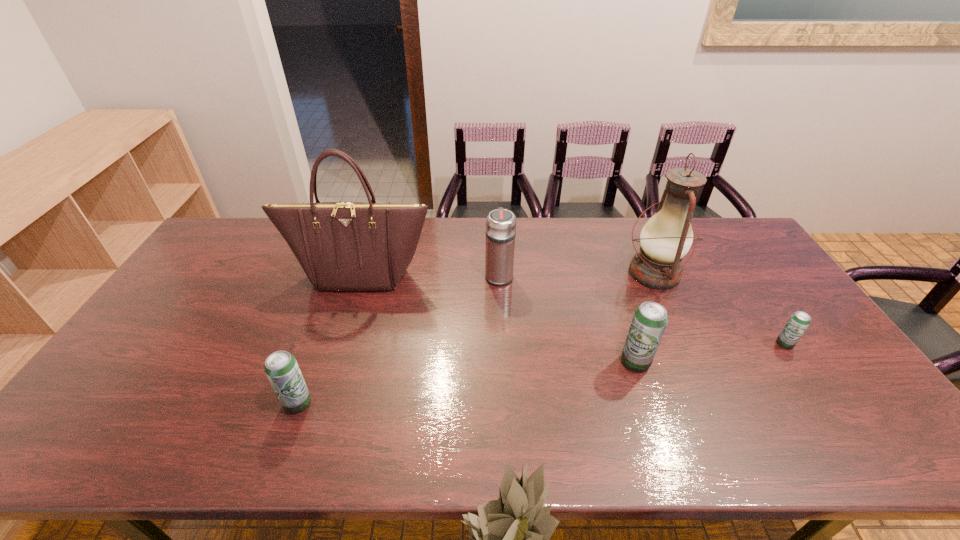
Locate an element on the screen. the second shortest beer can is located at coordinates point(281,367).

I want to click on the nearest object, so click(281, 367).

The height and width of the screenshot is (540, 960). What are the coordinates of `the second beer can from right to left` in the screenshot? It's located at (650, 319).

At what (x,y) coordinates should I click in order to perform the action: click on the second nearest object. Please return your answer as a coordinate pair (x, y). This screenshot has height=540, width=960. Looking at the image, I should click on (650, 319).

Image resolution: width=960 pixels, height=540 pixels. In order to click on the shortest object in this screenshot , I will do click(x=799, y=321).

The image size is (960, 540). I want to click on the rightmost beer can, so click(799, 321).

At what (x,y) coordinates should I click in order to perform the action: click on handbag. Please return your answer as a coordinate pair (x, y). The height and width of the screenshot is (540, 960). Looking at the image, I should click on (342, 246).

Image resolution: width=960 pixels, height=540 pixels. I want to click on oil lamp, so click(x=667, y=236).

I want to click on the third object from left to right, so click(x=500, y=232).

Find the location of `thermos bottle`. thermos bottle is located at coordinates (500, 232).